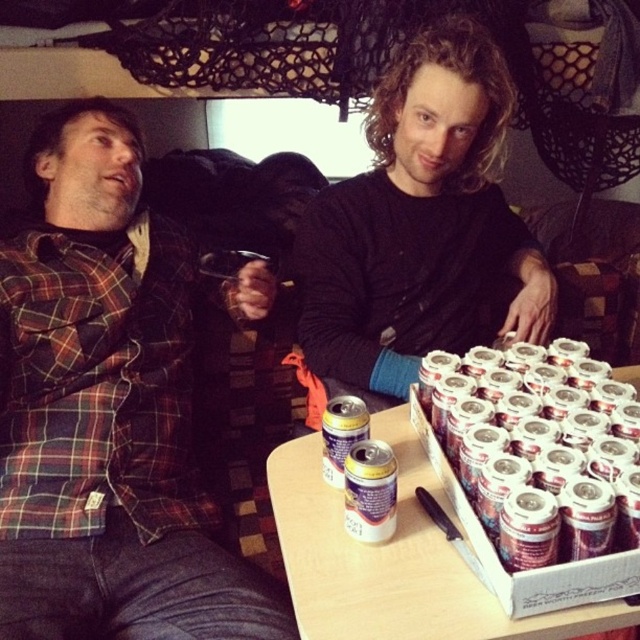
Consider the image. You are a photographer trying to capture a closeup of the gold foil can at center without including the plaid fabric shirt at left in the frame. Is this possible given their positions?

The plaid fabric shirt at left is further to the viewer than the gold foil can at center, so it would block the view of the gold foil can at center. Therefore, it is not possible to capture a closeup of the gold foil can at center without including the plaid fabric shirt at left in the frame.

You are a photographer standing in front of the table. You want to take a photo of the metallic silver can at center without the plaid fabric shirt at left blocking it. Is this possible?

The plaid fabric shirt at left is further to the viewer than the metallic silver can at center, so it will block the view of the can. Move to the side where the shirt is not blocking the can to take the photo.